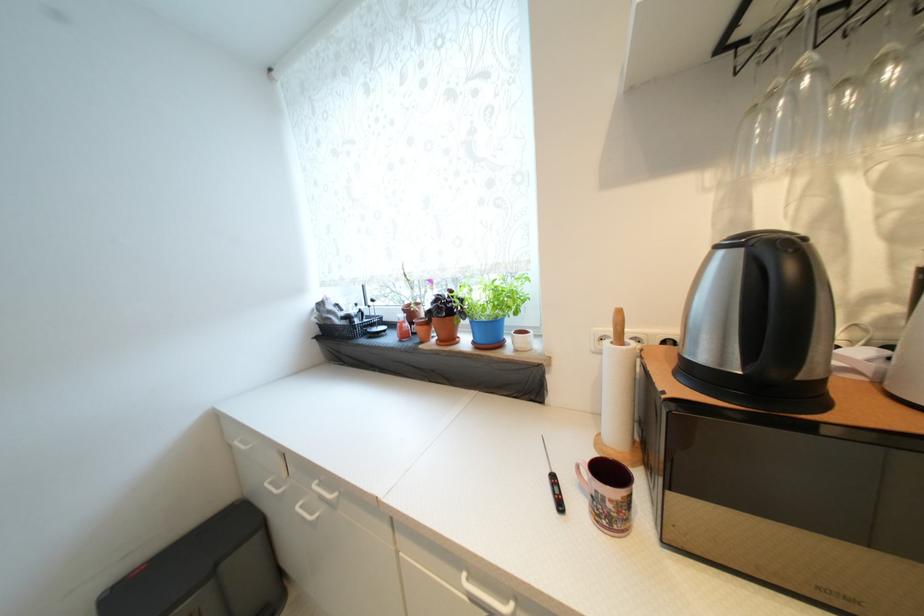
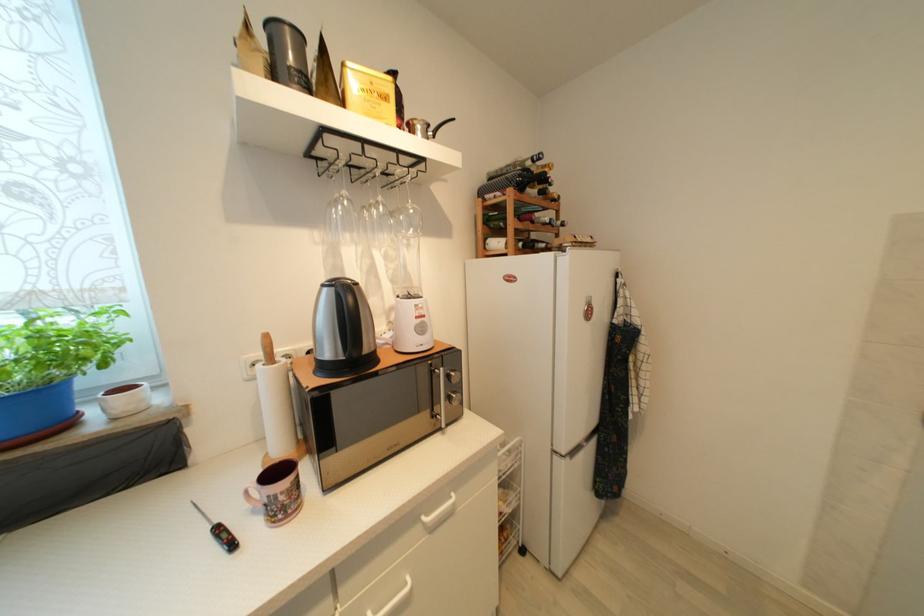
In the second image, find the point that corresponds to (x=565, y=508) in the first image.

(237, 546)